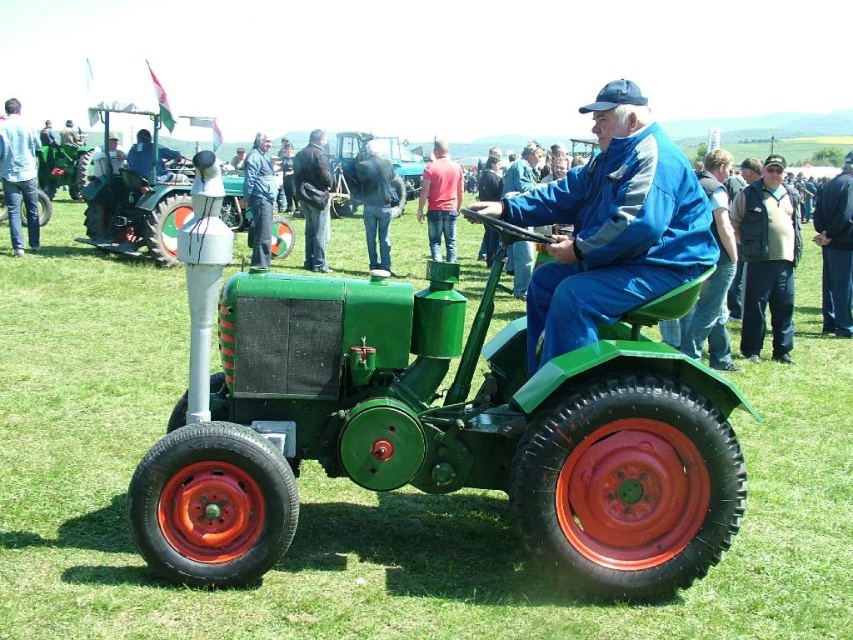
You are a photographer standing in the field. You want to take a photo of the green matte tractor at left without any obstructions. Is the denim jacket at center blocking your view of the tractor?

The denim jacket at center is in front of the green matte tractor at left, so it is blocking the view of the tractor. Move to a position where the denim jacket at center is not between you and the green matte tractor at left to capture an unobstructed image.

You are standing at the origin point of the coordinate system. You want to walk to the green grass at center. Which direction should you go?

The green grass at center is located at coordinate point (357, 497), so you should move towards the northeast direction to reach it.

You are standing in the field and want to pick up the blue denim jacket at center. Which direction should you move to reach it first, considering the green grass at center is in your way?

Since the green grass at center is closer to you than the blue denim jacket at center, you should move forward towards the blue denim jacket at center as the grass is between you and the jacket.